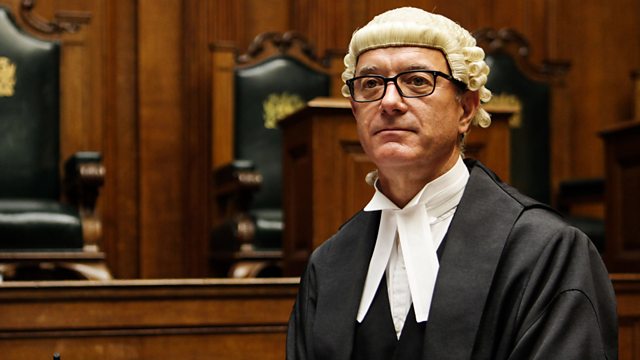
In order to click on chair in this screenshot , I will do `click(47, 118)`, `click(253, 99)`, `click(528, 109)`.